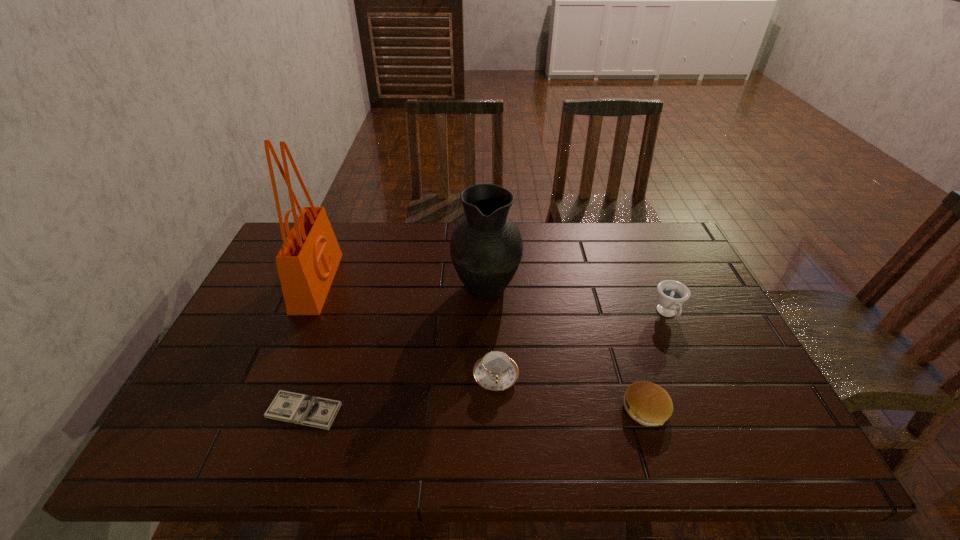
Locate an element on the screen. object that is positioned at the left edge is located at coordinates (307, 262).

Identify the location of object present at the right edge. (671, 296).

Locate an element on the screen. object positioned at the far left corner is located at coordinates (307, 262).

This screenshot has width=960, height=540. Identify the location of free space at the far edge of the desktop. (582, 240).

In the image, there is a desktop. At what (x,y) coordinates should I click in order to perform the action: click on vacant space at the near edge. Please return your answer as a coordinate pair (x, y). The image size is (960, 540). Looking at the image, I should click on (358, 460).

The image size is (960, 540). In order to click on vacant space at the right edge in this screenshot , I will do `click(680, 338)`.

This screenshot has width=960, height=540. Find the location of `vacant region at the near left corner`. vacant region at the near left corner is located at coordinates (206, 457).

Locate an element on the screen. Image resolution: width=960 pixels, height=540 pixels. vacant space at the far right corner of the desktop is located at coordinates click(666, 263).

Locate an element on the screen. free spot between the tallest object and the pitcher is located at coordinates (401, 284).

You are a GUI agent. You are given a task and a screenshot of the screen. Output one action in this format:
    pyautogui.click(x=<x>, y=<y>)
    Task: Click on the free spot between the third tallest object and the left teacup
    Image resolution: width=960 pixels, height=540 pixels.
    Given the screenshot: What is the action you would take?
    (x=582, y=345)